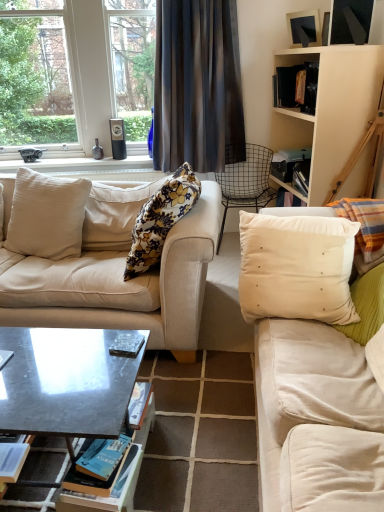
Question: In terms of width, does matte black speaker at upper left look wider or thinner when compared to wire mesh chair at center?

Choices:
 (A) thin
 (B) wide

Answer: (A)

Question: Which is correct: matte black speaker at upper left is inside wire mesh chair at center, or outside of it?

Choices:
 (A) outside
 (B) inside

Answer: (A)

Question: Estimate the real-world distances between objects in this image. Which object is farther from the metallic silver picture frame at upper right?

Choices:
 (A) metallic gray book at center, placed as the 2th book when sorted from top to bottom
 (B) clear glass window at upper left
 (C) beige fabric couch at center
 (D) hardcover book at center, placed as the first book when sorted from bottom to top
 (E) dark gray sheer curtain at upper center

Answer: (A)

Question: Considering the real-world distances, which object is farthest from the beige wood cabinet at upper right?

Choices:
 (A) wire mesh chair at center
 (B) clear glass window at upper left
 (C) hardcover book at center, placed as the first book when sorted from bottom to top
 (D) metallic silver picture frame at upper right
 (E) metallic gray book at center, marked as the 2th book in a bottom-to-top arrangement

Answer: (E)